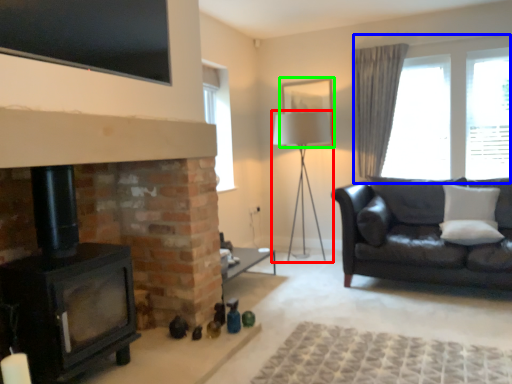
Question: Considering the real-world distances, which object is farthest from table lamp (highlighted by a red box)? window (highlighted by a blue box) or picture frame (highlighted by a green box)?

Choices:
 (A) window
 (B) picture frame

Answer: (A)